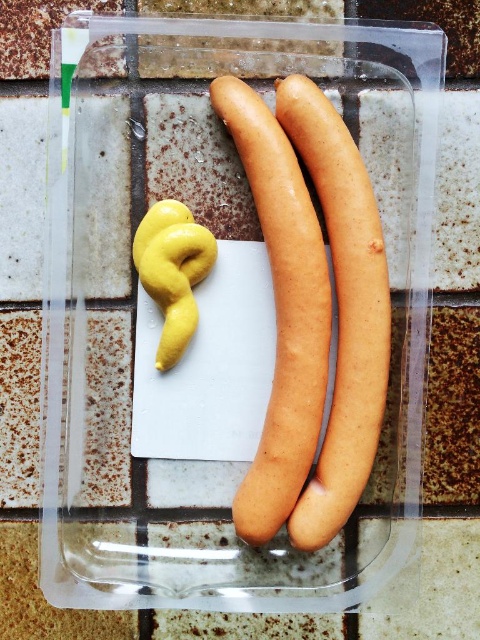
You are a food delivery person who needs to pack a smooth beige sausage at center and a smooth beige hot dog at center into a box that can only hold items up to 10 cm in width. Given their widths, can both items fit side by side in the box?

The smooth beige sausage at center is wider than the smooth beige hot dog at center. Since the box can only hold items up to 10 cm in width, both items can fit side by side only if their combined widths are less than or equal to 10 cm. However, without knowing the exact widths, it is impossible to determine if they will fit together.

You are at a barbecue and need to place both the smooth beige sausage at center and the smooth beige hot dog at center onto a grill. Based on their positions in the container, which one should you grab first to maintain the order shown?

You should grab the smooth beige sausage at center first because it is positioned to the left of the smooth beige hot dog at center, so taking it first maintains the original left to right order.

You are a delivery person who needs to place a package at the exact coordinates of the smooth beige sausage at center. What coordinates should you use?

The coordinates for the smooth beige sausage at center are at point [282,310].